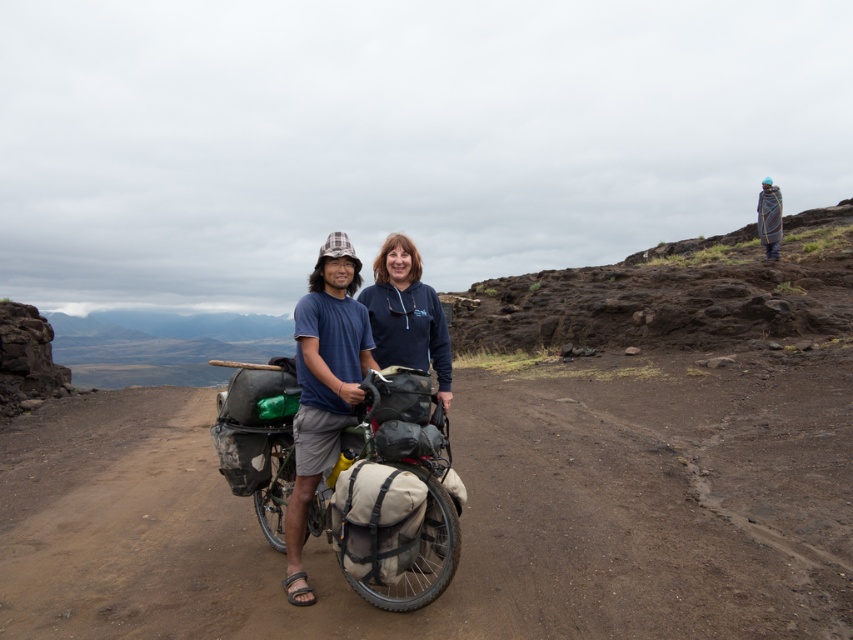
You are navigating a rugged landscape and need to follow the brown dirt track at center. According to the map, your destination is 2 kilometers north of this point. Which direction should you head relative to the current position?

The brown dirt track at center is located at point [465,509]. To reach your destination 2 kilometers north, you should head north along the brown dirt track at center.

Looking at this image, you are a hiker trying to navigate a rocky path. You see two points marked on your map corresponding to coordinates in the scene. The first point is at point [137,460] and the second is at point [294,568]. Which point is closer to your current position if you are standing behind both points?

Point [137,460] is behind point [294,568], so if you are standing behind both points, the point [294,568] is closer to your current position.

You are a hiker trying to cross the brown dirt track at center while avoiding getting your dark blue hoodie at center wet from rain. Given the current weather conditions, which object is more likely to get wet and why?

The dark blue hoodie at center is more likely to get wet because the brown dirt track at center is much taller and would provide shelter from the rain.